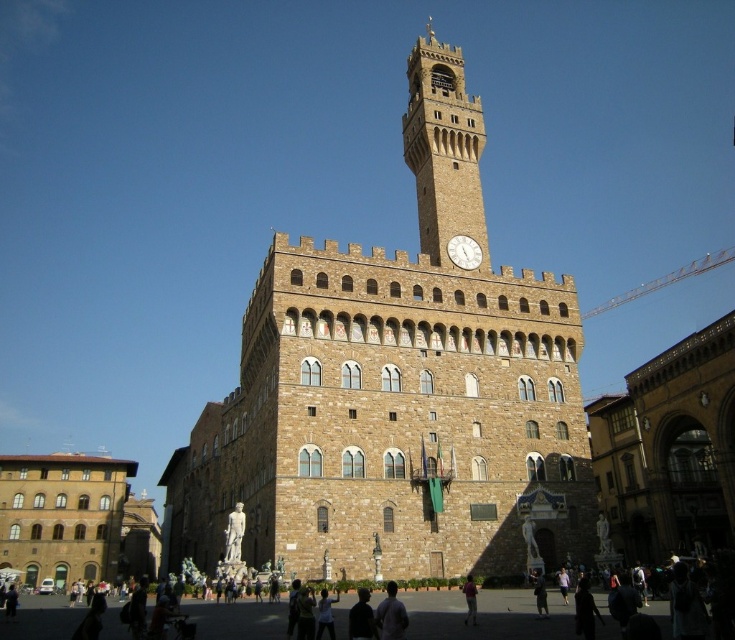
Is light blue shirt at lower center behind white stone clock at center?

No.

Consider the image. Is light blue shirt at lower center shorter than white stone clock at center?

No, light blue shirt at lower center is not shorter than white stone clock at center.

The image size is (735, 640). Find the location of `light blue shirt at lower center`. light blue shirt at lower center is located at coordinates (390, 616).

At what (x,y) coordinates should I click in order to perform the action: click on light blue shirt at lower center. Please return your answer as a coordinate pair (x, y). The image size is (735, 640). Looking at the image, I should click on (390, 616).

From the picture: Does brown stone tower at center lie behind white stone clock at center?

No, brown stone tower at center is in front of white stone clock at center.

Who is positioned more to the left, brown stone tower at center or white stone clock at center?

brown stone tower at center

Who is more forward, (x=517, y=532) or (x=462, y=241)?

Positioned in front is point (x=517, y=532).

Find the location of a particular element. Image resolution: width=735 pixels, height=640 pixels. brown stone tower at center is located at coordinates (397, 394).

Who is lower down, brown stone tower at center or dark brown leather jacket at lower center?

dark brown leather jacket at lower center is below.

Measure the distance between point (365, 349) and camera.

Point (365, 349) is 148.34 feet away from camera.

The width and height of the screenshot is (735, 640). I want to click on brown stone tower at center, so click(x=397, y=394).